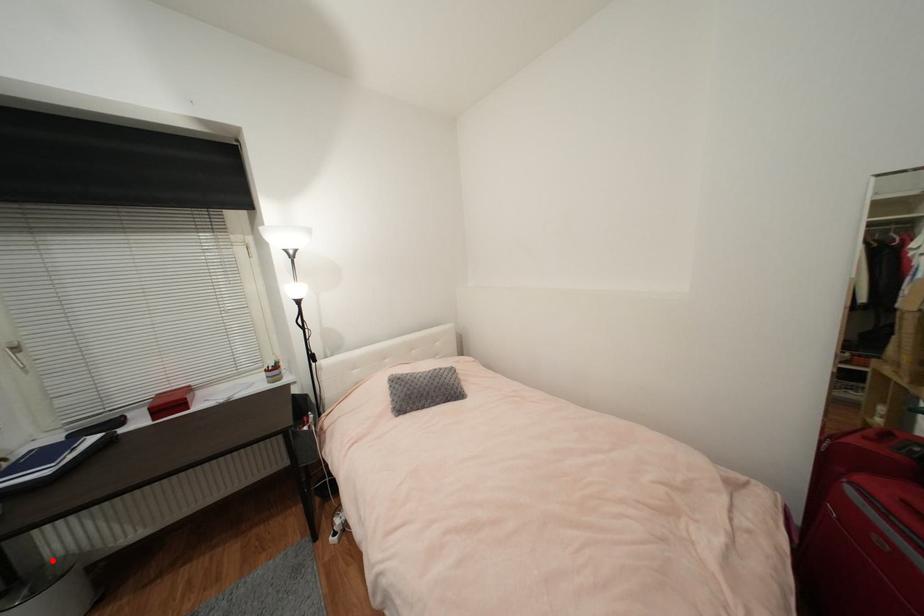
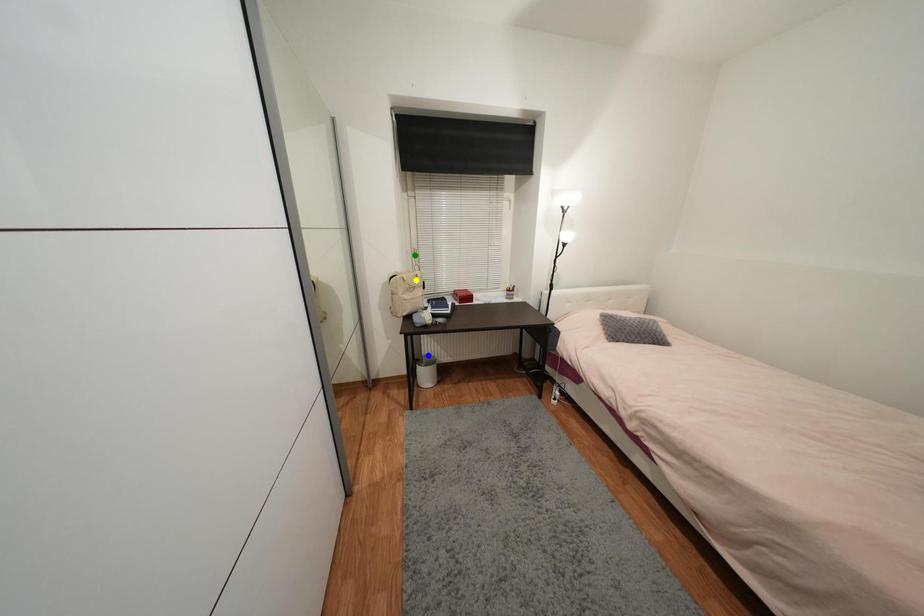
Question: I am providing you with two images of the same scene from different viewpoints. A red point is marked on the first image. You are given multiple points on the second image. Which mark in image 2 goes with the point in image 1?

Choices:
 (A) yellow point
 (B) blue point
 (C) green point

Answer: (B)